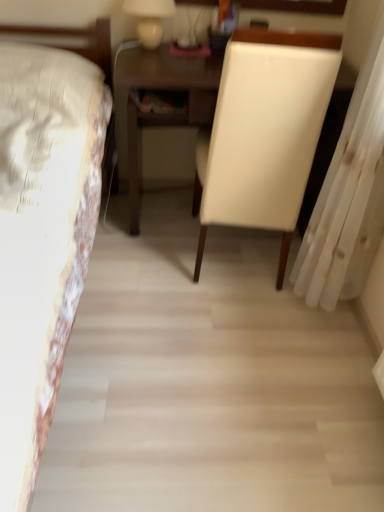
Question: Does white floral fabric bed at left appear on the left side of white leather chair at center?

Choices:
 (A) yes
 (B) no

Answer: (A)

Question: Is white floral fabric bed at left oriented towards white leather chair at center?

Choices:
 (A) yes
 (B) no

Answer: (B)

Question: From a real-world perspective, is white floral fabric bed at left under white leather chair at center?

Choices:
 (A) yes
 (B) no

Answer: (A)

Question: Are white floral fabric bed at left and white leather chair at center far apart?

Choices:
 (A) no
 (B) yes

Answer: (A)

Question: Is white floral fabric bed at left bigger than white leather chair at center?

Choices:
 (A) no
 (B) yes

Answer: (B)

Question: Is white floral fabric bed at left to the right of white leather chair at center from the viewer's perspective?

Choices:
 (A) yes
 (B) no

Answer: (B)

Question: From the image's perspective, is white floral fabric bed at left located above white sheer curtain at right?

Choices:
 (A) yes
 (B) no

Answer: (B)

Question: Is white floral fabric bed at left facing towards white sheer curtain at right?

Choices:
 (A) yes
 (B) no

Answer: (B)

Question: Can you confirm if white floral fabric bed at left is positioned to the left of white sheer curtain at right?

Choices:
 (A) no
 (B) yes

Answer: (B)

Question: Can you confirm if white floral fabric bed at left is smaller than white sheer curtain at right?

Choices:
 (A) yes
 (B) no

Answer: (B)

Question: Is the position of white floral fabric bed at left more distant than that of white sheer curtain at right?

Choices:
 (A) yes
 (B) no

Answer: (B)

Question: Does white floral fabric bed at left have a larger size compared to white sheer curtain at right?

Choices:
 (A) yes
 (B) no

Answer: (A)

Question: From a real-world perspective, is matte white lamp at upper center on white leather chair at center?

Choices:
 (A) no
 (B) yes

Answer: (B)